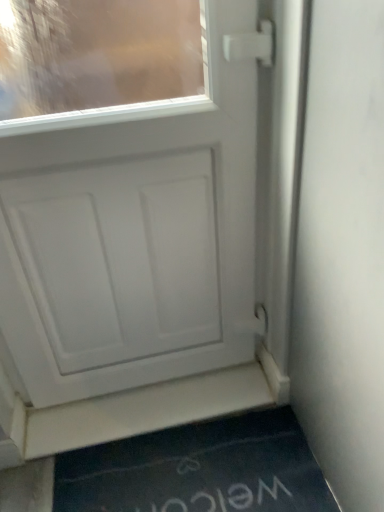
Question: Considering the positions of white matte door at center and dark blue rubber doormat at lower center in the image, is white matte door at center taller or shorter than dark blue rubber doormat at lower center?

Choices:
 (A) tall
 (B) short

Answer: (A)

Question: From the image's perspective, is white matte door at center located above or below dark blue rubber doormat at lower center?

Choices:
 (A) above
 (B) below

Answer: (A)

Question: Considering the real-world distances, which object is closest to the white matte door at center?

Choices:
 (A) white matte door at lower center
 (B) dark blue rubber doormat at lower center

Answer: (A)

Question: Which object is positioned farthest from the white matte door at lower center?

Choices:
 (A) white matte door at center
 (B) dark blue rubber doormat at lower center

Answer: (A)